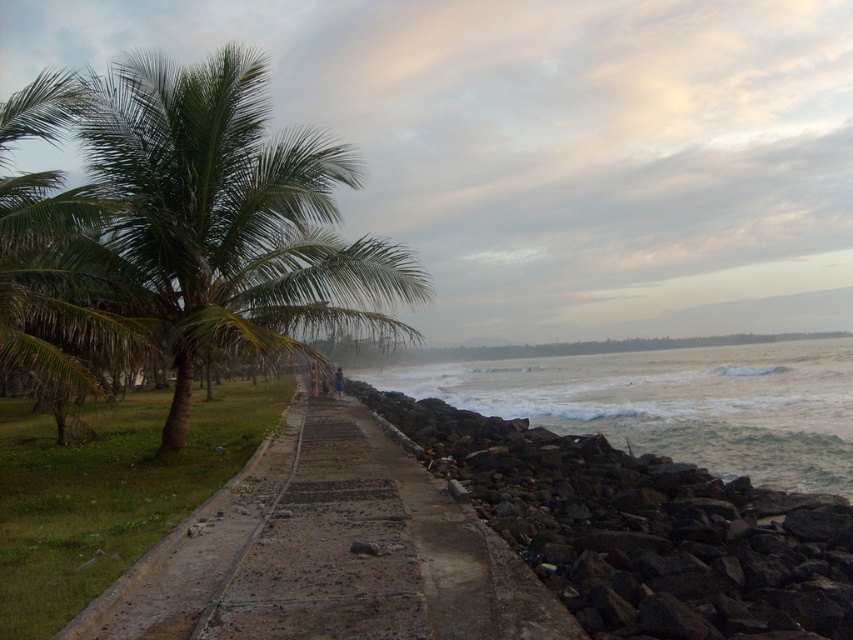
Question: Can you confirm if dark gray rocky wall at lower right is positioned above white frothy water at right?

Choices:
 (A) no
 (B) yes

Answer: (A)

Question: Which object appears farthest from the camera in this image?

Choices:
 (A) white frothy water at right
 (B) dark gray rocky wall at lower right

Answer: (A)

Question: Which object is farther from the camera taking this photo?

Choices:
 (A) concrete at center
 (B) green leafy palm tree at left
 (C) dark gray rocky wall at lower right
 (D) white frothy water at right

Answer: (D)

Question: Considering the relative positions of concrete at center and white frothy water at right in the image provided, where is concrete at center located with respect to white frothy water at right?

Choices:
 (A) left
 (B) right

Answer: (A)

Question: Considering the real-world distances, which object is closest to the white frothy water at right?

Choices:
 (A) green leafy palm tree at left
 (B) dark gray rocky wall at lower right

Answer: (B)

Question: Does concrete at center appear on the right side of white frothy water at right?

Choices:
 (A) no
 (B) yes

Answer: (A)